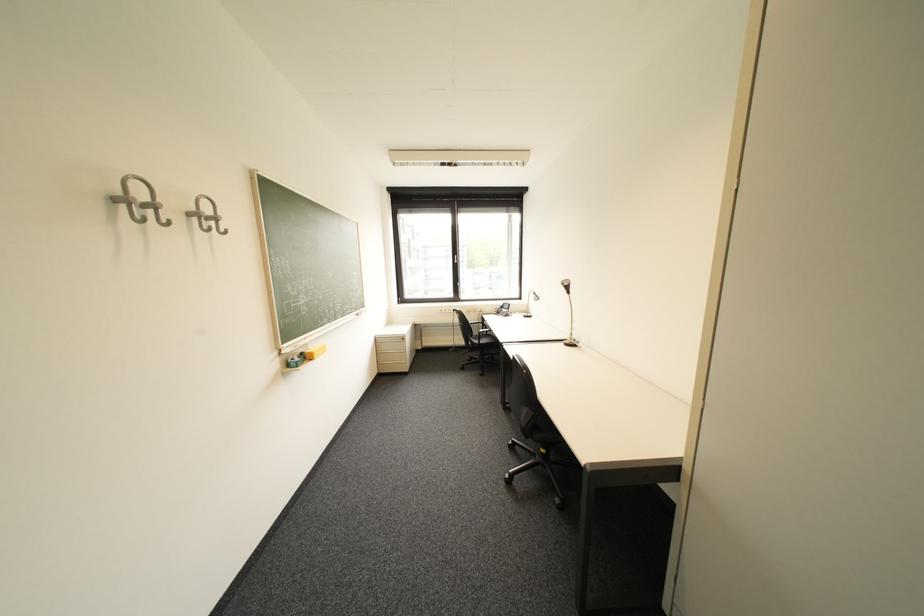
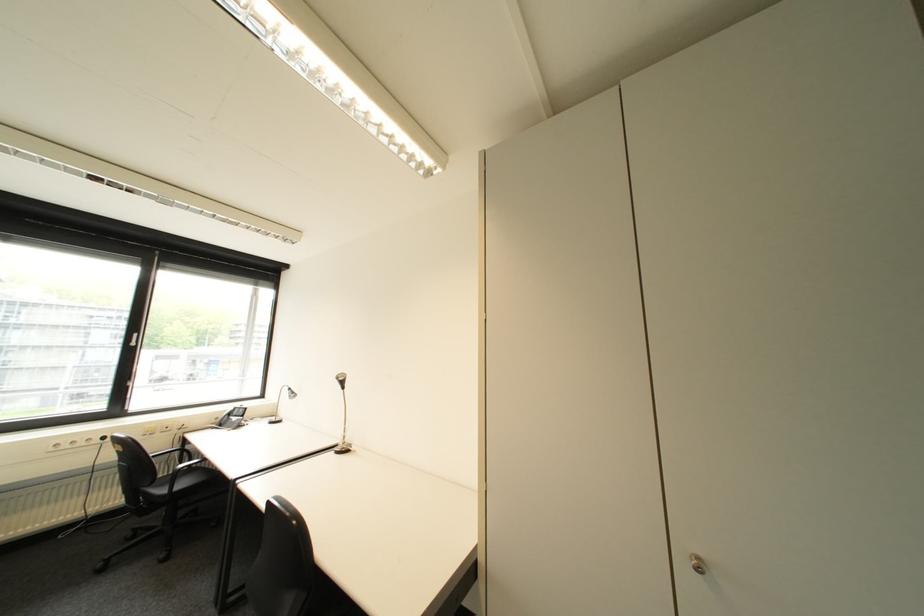
Locate, in the second image, the point that corresponds to (575,342) in the first image.

(346, 450)